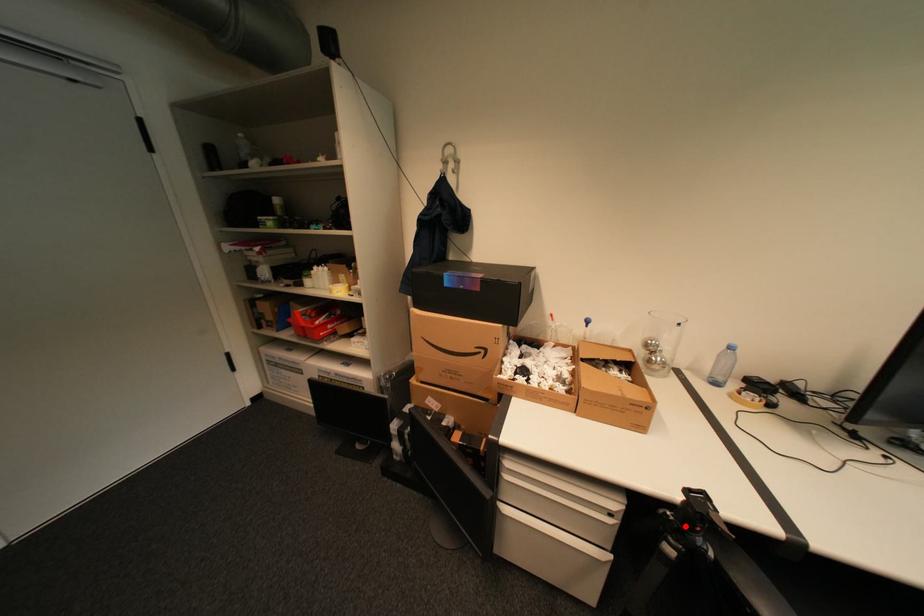
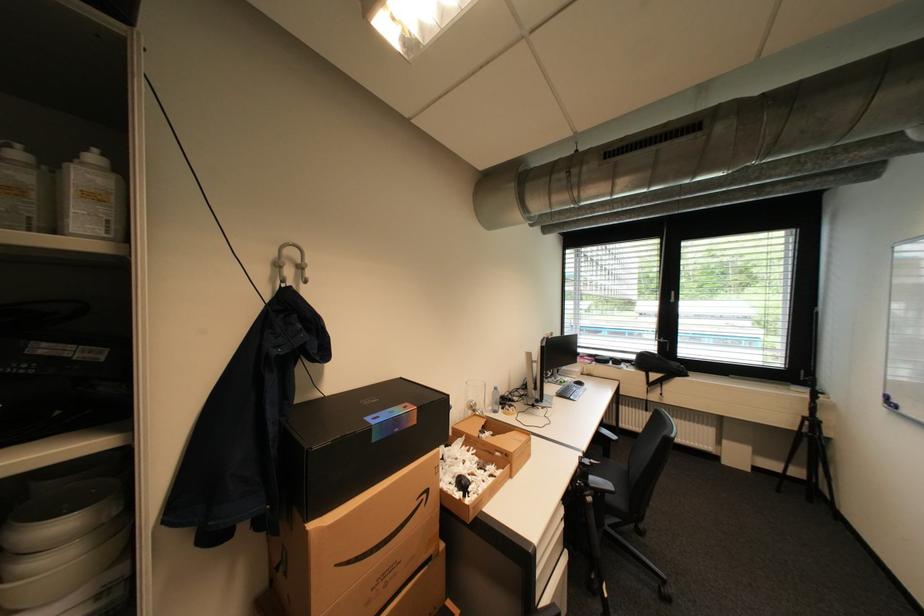
Find the pixel in the second image that matches the highlighted location in the first image.

(591, 485)